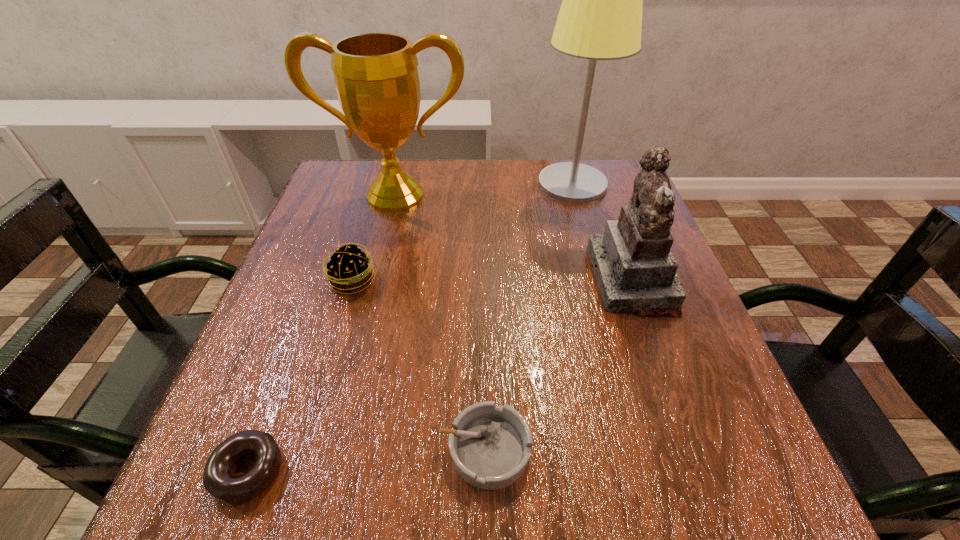
Locate an element on the screen. The width and height of the screenshot is (960, 540). free spot between the figurine and the tallest object is located at coordinates (602, 232).

I want to click on the second closest object relative to the award, so click(600, 18).

Locate an element on the screen. This screenshot has width=960, height=540. object that is the nearest to the tallest object is located at coordinates (635, 270).

This screenshot has width=960, height=540. In order to click on vacant position in the image that satisfies the following two spatial constraints: 1. on the front-facing side of the fourth shortest object; 2. on the front side of the ashtray in this screenshot , I will do coord(691,449).

Where is `free spot that satisfies the following two spatial constraints: 1. on the back side of the table lamp; 2. on the right side of the ashtray`? free spot that satisfies the following two spatial constraints: 1. on the back side of the table lamp; 2. on the right side of the ashtray is located at coordinates (483, 185).

Where is `vacant position in the image that satisfies the following two spatial constraints: 1. on the front-facing side of the award; 2. on the left side of the ashtray`? This screenshot has width=960, height=540. vacant position in the image that satisfies the following two spatial constraints: 1. on the front-facing side of the award; 2. on the left side of the ashtray is located at coordinates (333, 449).